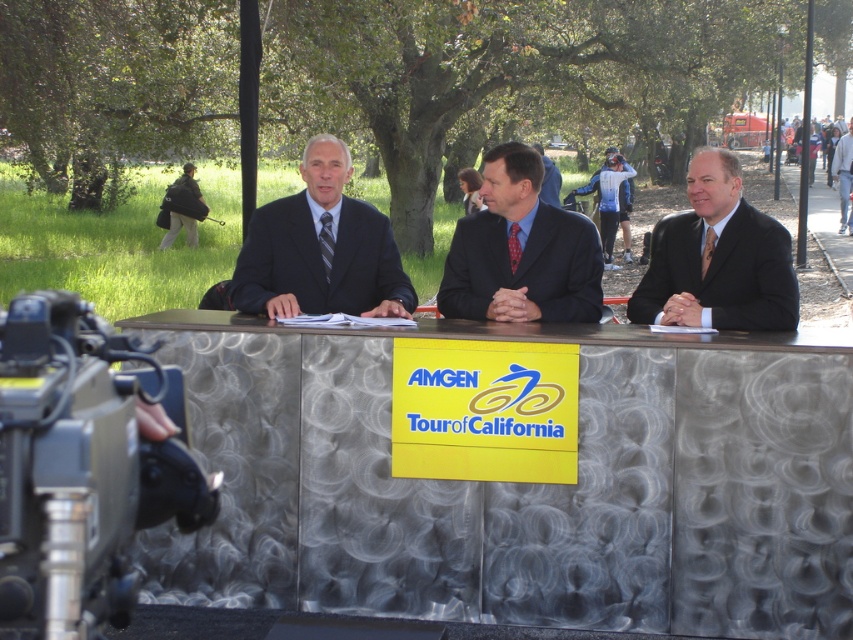
Question: Which is farther from the matte black suit at right?

Choices:
 (A) metallic textured table at center
 (B) black plastic video camera at lower left
 (C) gray suit at center
 (D) matte black suit at center

Answer: (C)

Question: Does metallic textured table at center appear on the left side of matte black suit at center?

Choices:
 (A) no
 (B) yes

Answer: (A)

Question: Can you confirm if matte black suit at center is positioned below matte black suit at right?

Choices:
 (A) no
 (B) yes

Answer: (A)

Question: Among these objects, which one is nearest to the camera?

Choices:
 (A) matte black suit at center
 (B) dark suit at center
 (C) matte black suit at right

Answer: (C)

Question: Considering the relative positions of black plastic video camera at lower left and matte black suit at center in the image provided, where is black plastic video camera at lower left located with respect to matte black suit at center?

Choices:
 (A) left
 (B) right

Answer: (A)

Question: Which object is farther from the camera taking this photo?

Choices:
 (A) metallic textured table at center
 (B) gray suit at center
 (C) matte black suit at center

Answer: (B)